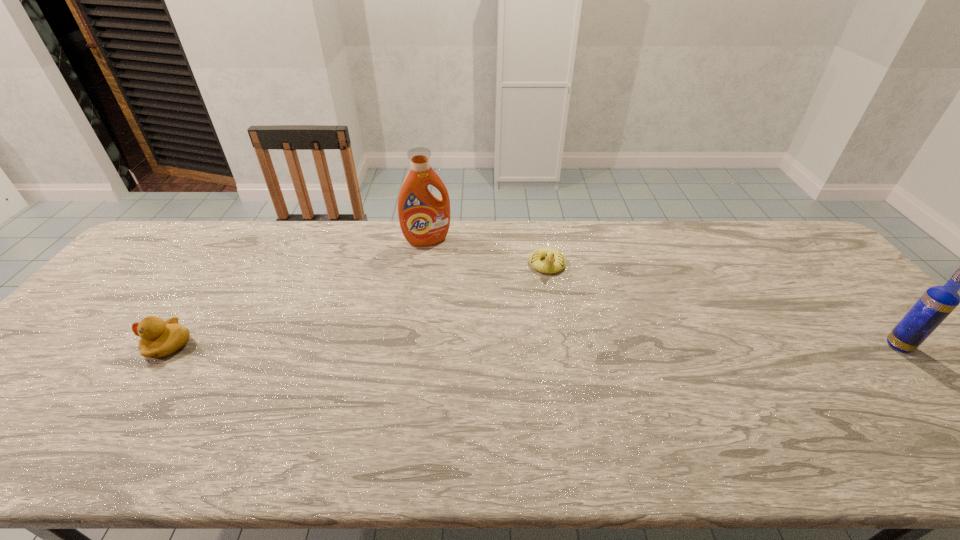
Locate an element on the screen. Image resolution: width=960 pixels, height=540 pixels. vacant area located 0.150m at the beak of the second shortest object is located at coordinates point(87,345).

Locate an element on the screen. Image resolution: width=960 pixels, height=540 pixels. free space located on the back of the rightmost object is located at coordinates coord(860,304).

Find the location of a particular element. The width and height of the screenshot is (960, 540). vacant space located on the face of the third object from left to right is located at coordinates (546, 299).

Identify the location of blank space located 0.360m on the face of the third object from left to right. (544, 376).

The height and width of the screenshot is (540, 960). In order to click on vacant region located on the face of the third object from left to right in this screenshot , I will do (544, 372).

Find the location of a particular element. The width and height of the screenshot is (960, 540). vacant area located on the front-facing side of the farthest object is located at coordinates (455, 298).

Find the location of `vacant space positioned 0.320m on the front-facing side of the farthest object`. vacant space positioned 0.320m on the front-facing side of the farthest object is located at coordinates (462, 314).

Locate an element on the screen. free region located 0.050m on the front-facing side of the farthest object is located at coordinates (438, 256).

Where is `duckling present at the far edge`? The height and width of the screenshot is (540, 960). duckling present at the far edge is located at coordinates (549, 266).

This screenshot has height=540, width=960. Identify the location of detergent that is at the far edge. (424, 219).